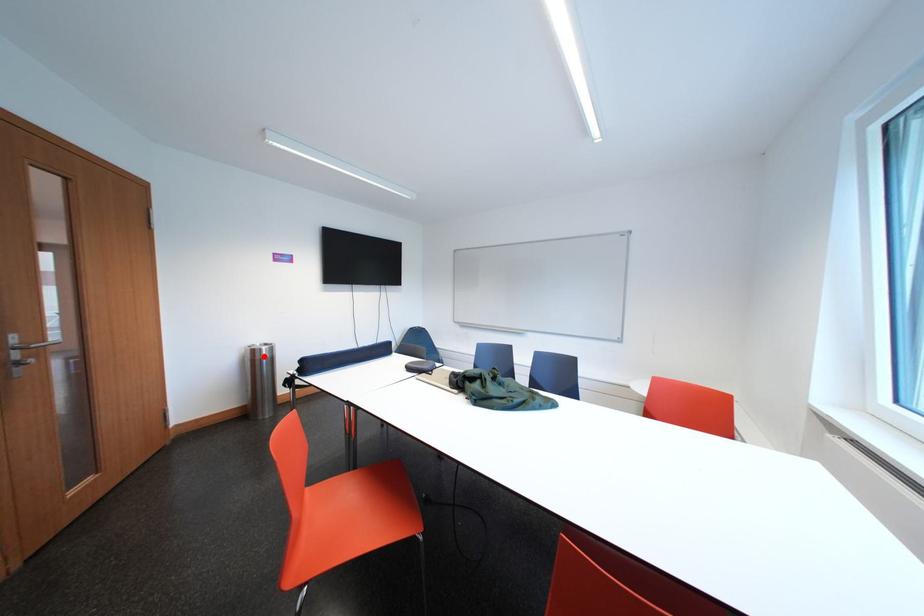
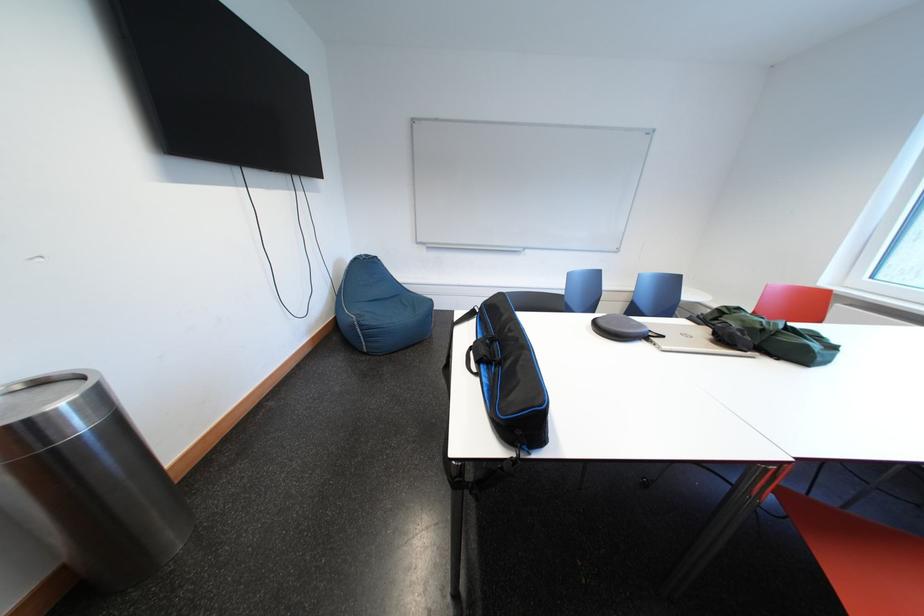
Question: I am providing you with two images of the same scene from different viewpoints. Given a red point in image1, look at the same physical point in image2. Is it:

Choices:
 (A) Closer to the viewpoint
 (B) Farther from the viewpoint

Answer: (A)